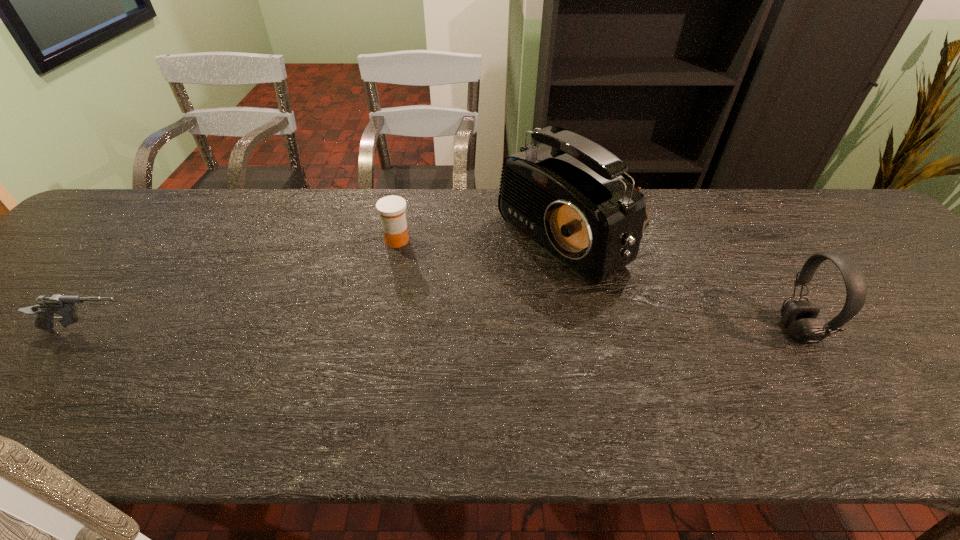
I want to click on the leftmost object, so click(47, 306).

The height and width of the screenshot is (540, 960). I want to click on the rightmost object, so click(x=799, y=317).

Identify the location of headset. (799, 317).

You are a GUI agent. You are given a task and a screenshot of the screen. Output one action in this format:
    pyautogui.click(x=<x>, y=<y>)
    Task: Click on the second object from right to left
    Image resolution: width=960 pixels, height=540 pixels.
    Given the screenshot: What is the action you would take?
    pyautogui.click(x=566, y=195)

Where is `radio receiver`? This screenshot has width=960, height=540. radio receiver is located at coordinates (566, 195).

What are the coordinates of `the second object from left to right` in the screenshot? It's located at (392, 208).

This screenshot has height=540, width=960. Find the location of `free space located 0.320m at the barrel of the gun`. free space located 0.320m at the barrel of the gun is located at coordinates (283, 331).

Locate an element on the screen. free region located on the front-facing side of the headset is located at coordinates (838, 331).

This screenshot has height=540, width=960. Identify the location of vacant space located 0.110m on the front-facing side of the third object from left to right. (484, 287).

Locate an element on the screen. This screenshot has width=960, height=540. vacant point located on the front-facing side of the third object from left to right is located at coordinates (474, 293).